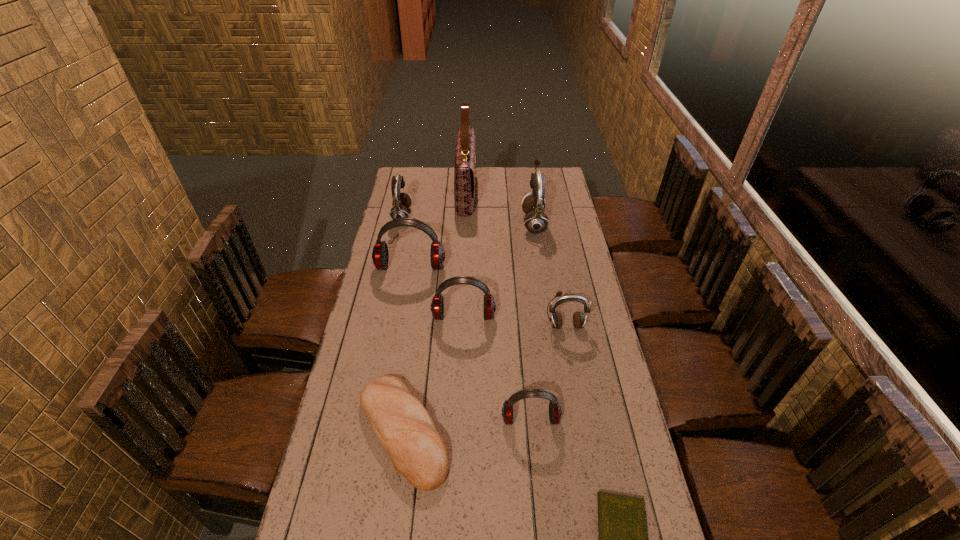
This screenshot has width=960, height=540. In order to click on the rightmost red earphone in this screenshot , I will do click(x=555, y=412).

Locate an element on the screen. This screenshot has width=960, height=540. the eighth tallest object is located at coordinates (403, 426).

Where is `bread`? Image resolution: width=960 pixels, height=540 pixels. bread is located at coordinates (403, 426).

At what (x,y) coordinates should I click in order to perform the action: click on free space located 0.390m on the front of the handbag with the clasp. Please return your answer as a coordinate pair (x, y). This screenshot has height=540, width=960. Looking at the image, I should click on (552, 193).

Locate an element on the screen. The image size is (960, 540). vacant space situated 0.310m on the ear pads of the tallest earphone is located at coordinates (457, 222).

The image size is (960, 540). In order to click on free region located 0.070m on the ear pads of the tallest earphone in this screenshot , I will do `click(507, 222)`.

In order to click on vacant space situated on the ear pads of the tallest earphone in this screenshot , I will do `click(444, 222)`.

The image size is (960, 540). I want to click on vacant space located on the ear cups of the fourth nearest earphone, so click(407, 288).

This screenshot has width=960, height=540. I want to click on vacant space located on the ear pads of the leftmost brown earphone, so click(x=463, y=216).

Image resolution: width=960 pixels, height=540 pixels. In order to click on vacant point located on the ear cups of the second nearest red earphone in this screenshot , I will do `click(462, 364)`.